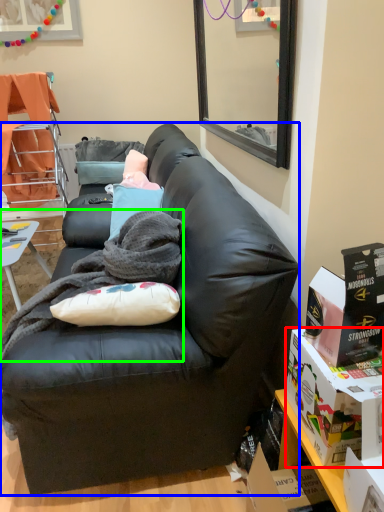
Question: Which object is positioned closest to box (highlighted by a red box)? Select from studio couch (highlighted by a blue box) and blanket (highlighted by a green box).

Choices:
 (A) studio couch
 (B) blanket

Answer: (A)